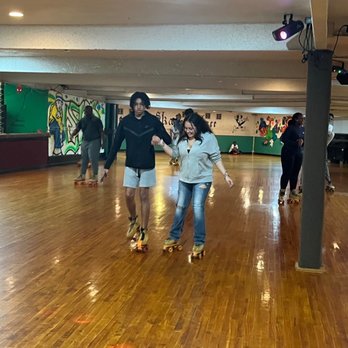
The width and height of the screenshot is (348, 348). Find the location of `door`. door is located at coordinates (109, 124).